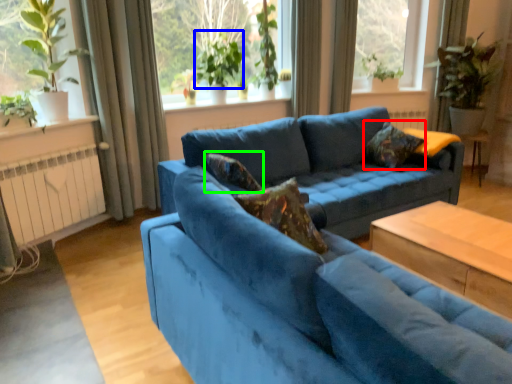
Question: Based on their relative distances, which object is farther from pillow (highlighted by a red box)? Choose from plant (highlighted by a blue box) and pillow (highlighted by a green box).

Choices:
 (A) plant
 (B) pillow

Answer: (A)